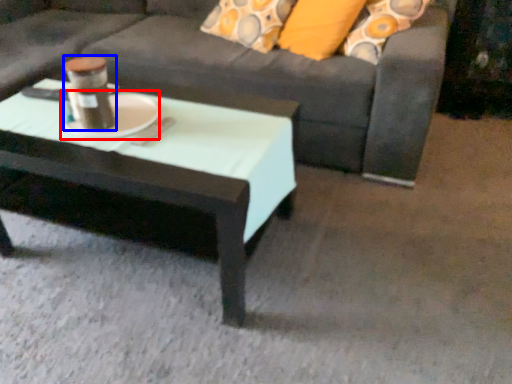
Question: Which point is further to the camera, platter (highlighted by a red box) or beverage (highlighted by a blue box)?

Choices:
 (A) platter
 (B) beverage

Answer: (A)